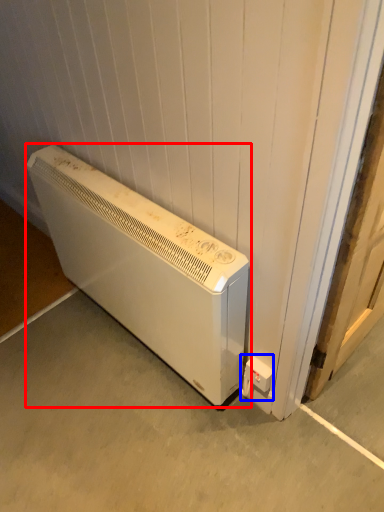
Question: Which object is closer to the camera taking this photo, home appliance (highlighted by a red box) or electric outlet (highlighted by a blue box)?

Choices:
 (A) home appliance
 (B) electric outlet

Answer: (A)